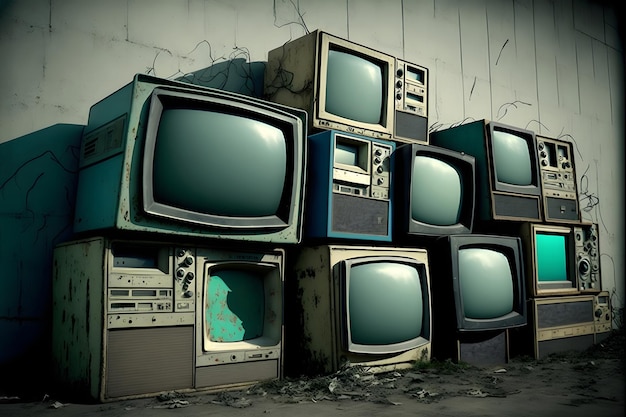
Find the location of a particular element. The width and height of the screenshot is (626, 417). televisions is located at coordinates (210, 311), (247, 163), (365, 85), (398, 304), (484, 273), (449, 183), (513, 159), (562, 277).